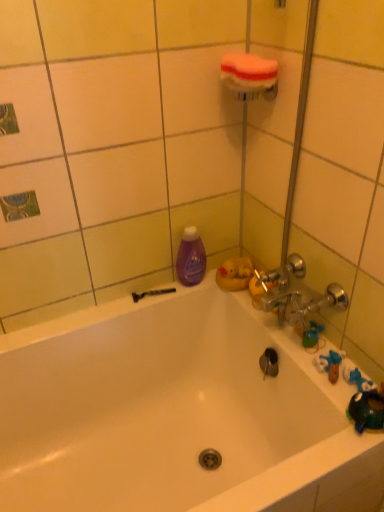
Question: Is black plastic razor at lower left aimed at orange sponge at upper center?

Choices:
 (A) no
 (B) yes

Answer: (A)

Question: Considering the relative sizes of black plastic razor at lower left and orange sponge at upper center in the image provided, is black plastic razor at lower left wider than orange sponge at upper center?

Choices:
 (A) no
 (B) yes

Answer: (A)

Question: Is black plastic razor at lower left at the left side of orange sponge at upper center?

Choices:
 (A) yes
 (B) no

Answer: (A)

Question: From the image's perspective, is black plastic razor at lower left located beneath orange sponge at upper center?

Choices:
 (A) no
 (B) yes

Answer: (B)

Question: From a real-world perspective, does black plastic razor at lower left sit lower than orange sponge at upper center?

Choices:
 (A) yes
 (B) no

Answer: (A)

Question: Based on their sizes in the image, would you say green rubber toy at right is bigger or smaller than black plastic razor at lower left?

Choices:
 (A) small
 (B) big

Answer: (B)

Question: Is point (302, 331) closer or farther from the camera than point (144, 294)?

Choices:
 (A) closer
 (B) farther

Answer: (A)

Question: In the image, is green rubber toy at right on the left side or the right side of black plastic razor at lower left?

Choices:
 (A) right
 (B) left

Answer: (A)

Question: Considering their positions, is green rubber toy at right located in front of or behind black plastic razor at lower left?

Choices:
 (A) behind
 (B) front

Answer: (B)

Question: Is black plastic razor at lower left wider or thinner than purple glossy bottle at upper left?

Choices:
 (A) wide
 (B) thin

Answer: (B)

Question: From the image's perspective, is black plastic razor at lower left above or below purple glossy bottle at upper left?

Choices:
 (A) above
 (B) below

Answer: (B)

Question: Would you say black plastic razor at lower left is inside or outside purple glossy bottle at upper left?

Choices:
 (A) outside
 (B) inside

Answer: (A)

Question: In the image, is black plastic razor at lower left positioned in front of or behind purple glossy bottle at upper left?

Choices:
 (A) front
 (B) behind

Answer: (B)

Question: Is purple glossy bottle at upper left taller or shorter than black plastic razor at lower left?

Choices:
 (A) tall
 (B) short

Answer: (A)

Question: In terms of size, does purple glossy bottle at upper left appear bigger or smaller than black plastic razor at lower left?

Choices:
 (A) big
 (B) small

Answer: (A)